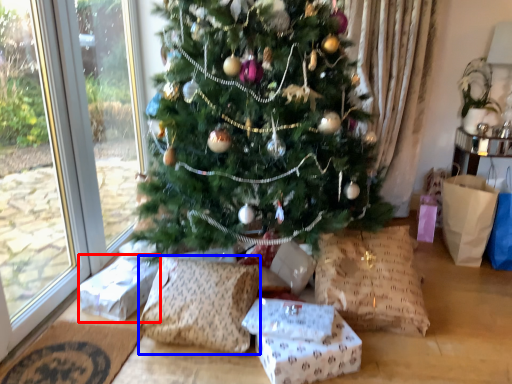
Question: Which object is further to the camera taking this photo, gift box (highlighted by a red box) or pillow (highlighted by a blue box)?

Choices:
 (A) gift box
 (B) pillow

Answer: (A)